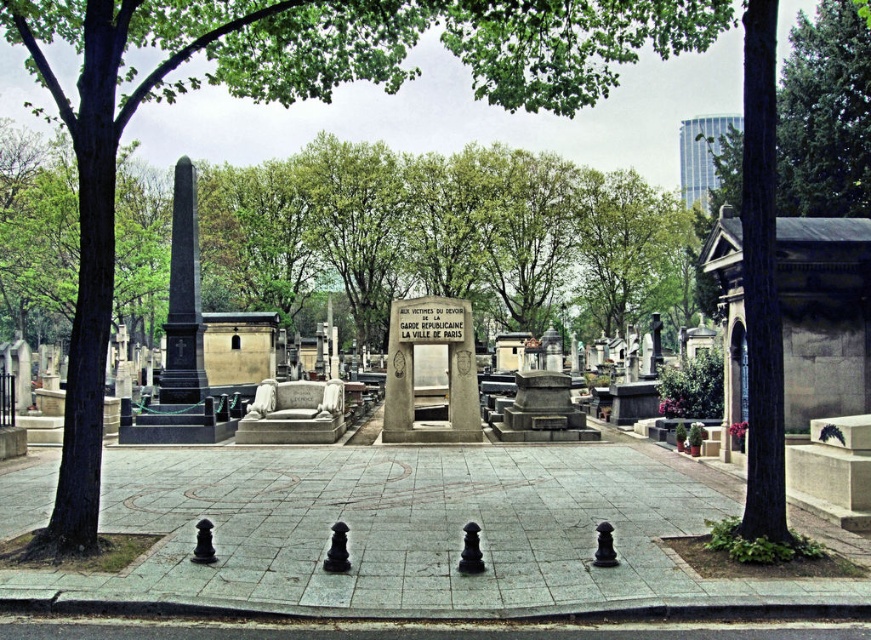
Question: Is green leafy tree at center to the right of polished stone monument at center from the viewer's perspective?

Choices:
 (A) yes
 (B) no

Answer: (B)

Question: Does green leafy tree at center have a greater width compared to polished stone monument at center?

Choices:
 (A) no
 (B) yes

Answer: (B)

Question: Which object is closer to the camera taking this photo?

Choices:
 (A) polished stone monument at center
 (B) green leafy tree at center

Answer: (B)

Question: Is green leafy tree at upper center wider than polished stone monument at center?

Choices:
 (A) yes
 (B) no

Answer: (A)

Question: Which point is closer to the camera taking this photo?

Choices:
 (A) (508, 24)
 (B) (406, 397)
 (C) (822, 108)

Answer: (A)

Question: Considering the real-world distances, which object is farthest from the green leafy tree at upper center?

Choices:
 (A) green leafy tree at center
 (B) polished stone monument at center

Answer: (B)